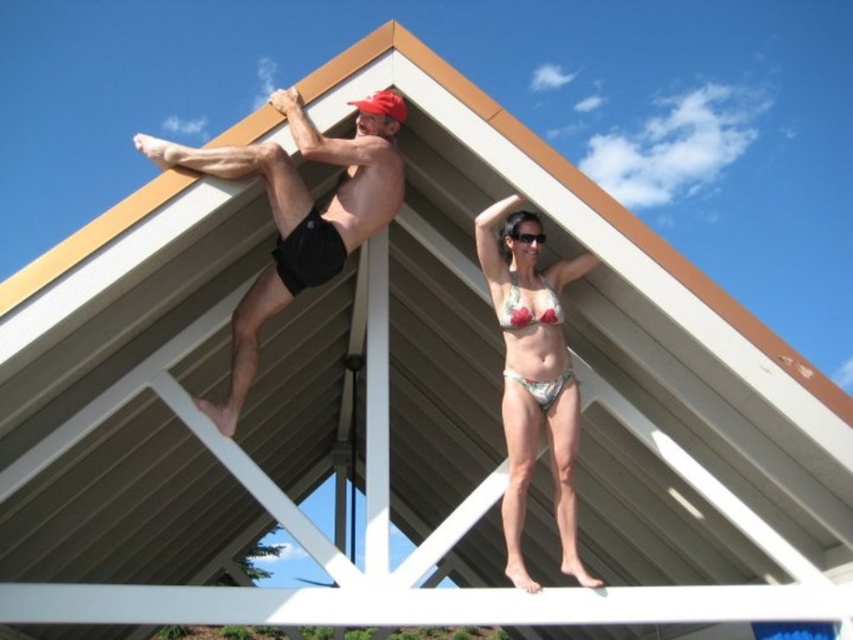
Based on the photo, does matte black shorts at upper left have a lesser height compared to printed fabric bikini top at upper center?

No.

Between point (547, 369) and point (553, 292), which one is positioned in front?

Point (547, 369)

Find the location of `matte black shorts at upper left`. matte black shorts at upper left is located at coordinates (299, 212).

Is matte black shorts at upper center closer to camera compared to printed fabric bikini top at upper center?

That is True.

Is matte black shorts at upper center thinner than printed fabric bikini top at upper center?

No.

Is point (293, 132) in front of point (544, 300)?

Yes, it is in front of point (544, 300).

Locate an element on the screen. This screenshot has height=640, width=853. matte black shorts at upper center is located at coordinates 299,212.

Which is behind, point (567, 548) or point (341, 154)?

Point (567, 548)

Is matte black shorts at upper left closer to camera compared to matte black shorts at upper center?

No.

Who is more forward, (175, 164) or (254, 317)?

Positioned in front is point (175, 164).

Where is `matte black shorts at upper left`? This screenshot has width=853, height=640. matte black shorts at upper left is located at coordinates (299, 212).